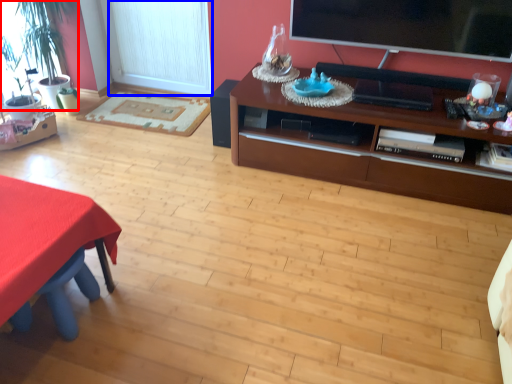
Question: Which object is closer to the camera taking this photo, houseplant (highlighted by a red box) or window screen (highlighted by a blue box)?

Choices:
 (A) houseplant
 (B) window screen

Answer: (A)